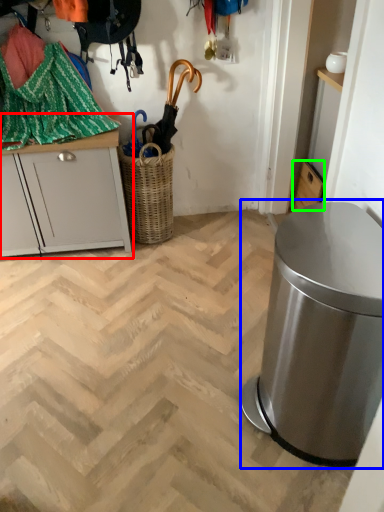
Question: Which object is the farthest from cabinetry (highlighted by a red box)? Choose among these: waste container (highlighted by a blue box) or cabinetry (highlighted by a green box).

Choices:
 (A) waste container
 (B) cabinetry

Answer: (B)